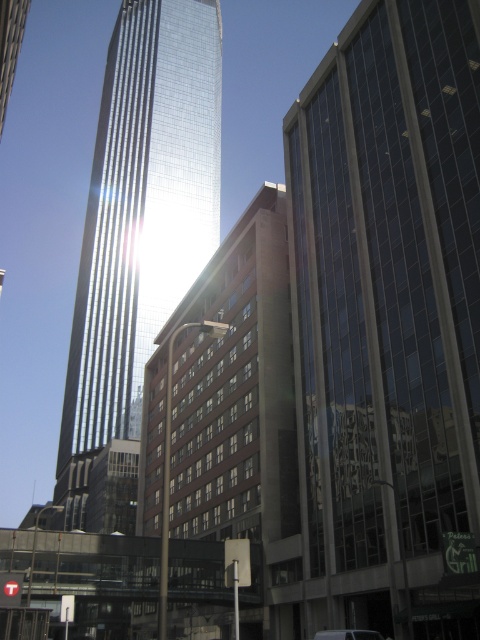
Which of these two, glassy reflective skyscraper at center or shiny glass skyscraper at center, stands shorter?

glassy reflective skyscraper at center is shorter.

From the picture: Does glassy reflective skyscraper at center have a greater width compared to shiny glass skyscraper at center?

In fact, glassy reflective skyscraper at center might be narrower than shiny glass skyscraper at center.

What do you see at coordinates (388, 320) in the screenshot? The image size is (480, 640). I see `glassy reflective skyscraper at center` at bounding box center [388, 320].

Where is `glassy reflective skyscraper at center`? This screenshot has width=480, height=640. glassy reflective skyscraper at center is located at coordinates pos(388,320).

Does glassy reflective skyscraper at center come in front of metallic silver van at center?

Yes, it is in front of metallic silver van at center.

Who is taller, glassy reflective skyscraper at center or metallic silver van at center?

glassy reflective skyscraper at center is taller.

Who is more forward, (428, 460) or (327, 634)?

Positioned in front is point (327, 634).

The height and width of the screenshot is (640, 480). I want to click on glassy reflective skyscraper at center, so click(x=388, y=320).

Can you confirm if shiny glass skyscraper at center is positioned below metallic silver van at center?

Incorrect, shiny glass skyscraper at center is not positioned below metallic silver van at center.

Is shiny glass skyscraper at center further to camera compared to metallic silver van at center?

That is True.

Where is `shiny glass skyscraper at center`? The width and height of the screenshot is (480, 640). shiny glass skyscraper at center is located at coordinates (143, 209).

Where is `shiny glass skyscraper at center`? shiny glass skyscraper at center is located at coordinates (143, 209).